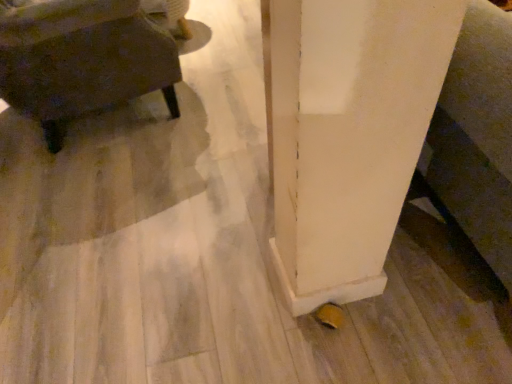
The height and width of the screenshot is (384, 512). Describe the element at coordinates (82, 59) in the screenshot. I see `matte dark brown coffee table at left` at that location.

This screenshot has height=384, width=512. In order to click on matte dark brown coffee table at left in this screenshot , I will do `click(82, 59)`.

The height and width of the screenshot is (384, 512). In order to click on white matte pillar at lower right in this screenshot , I will do `click(348, 134)`.

Consider the image. In order to face white matte pillar at lower right, should I rotate leftwards or rightwards?

Turn right approximately 34.573 degrees to face it.

Measure the distance between point (445, 61) and camera.

Point (445, 61) and camera are 26.65 inches apart.

What is the approximate height of white matte pillar at lower right?

31.15 inches.

This screenshot has width=512, height=384. What do you see at coordinates (348, 134) in the screenshot? I see `white matte pillar at lower right` at bounding box center [348, 134].

In order to click on matte dark brown coffee table at left in this screenshot , I will do `click(82, 59)`.

Considering the positions of objects white matte pillar at lower right and matte dark brown coffee table at left in the image provided, who is more to the right, white matte pillar at lower right or matte dark brown coffee table at left?

From the viewer's perspective, white matte pillar at lower right appears more on the right side.

In the image, is white matte pillar at lower right positioned in front of or behind matte dark brown coffee table at left?

In the image, white matte pillar at lower right appears in front of matte dark brown coffee table at left.

Considering the points (348, 206) and (142, 76), which point is in front, point (348, 206) or point (142, 76)?

The point (348, 206) is closer.

From the image's perspective, is white matte pillar at lower right beneath matte dark brown coffee table at left?

Indeed, from the image's perspective, white matte pillar at lower right is shown beneath matte dark brown coffee table at left.

From a real-world perspective, is white matte pillar at lower right under matte dark brown coffee table at left?

No, from a real-world perspective, white matte pillar at lower right is not below matte dark brown coffee table at left.

Is white matte pillar at lower right wider or thinner than matte dark brown coffee table at left?

Considering their sizes, white matte pillar at lower right looks broader than matte dark brown coffee table at left.

Does white matte pillar at lower right have a greater height compared to matte dark brown coffee table at left?

Yes.

Can you confirm if white matte pillar at lower right is bigger than matte dark brown coffee table at left?

Yes.

Do you think white matte pillar at lower right is within matte dark brown coffee table at left, or outside of it?

The correct answer is: outside.

Is white matte pillar at lower right far from matte dark brown coffee table at left?

Actually, white matte pillar at lower right and matte dark brown coffee table at left are a little close together.

Is white matte pillar at lower right facing away from matte dark brown coffee table at left?

No, white matte pillar at lower right is not facing away from matte dark brown coffee table at left.

How different are the orientations of white matte pillar at lower right and matte dark brown coffee table at left in degrees?

white matte pillar at lower right and matte dark brown coffee table at left are facing 72.2 degrees away from each other.

How distant is white matte pillar at lower right from matte dark brown coffee table at left?

white matte pillar at lower right is 36.01 inches from matte dark brown coffee table at left.

You are a GUI agent. You are given a task and a screenshot of the screen. Output one action in this format:
    pyautogui.click(x=<x>, y=<y>)
    Task: Click on the pillar in front of the matte dark brown coffee table at left
    Image resolution: width=512 pixels, height=384 pixels.
    Given the screenshot: What is the action you would take?
    pyautogui.click(x=348, y=134)

Which object is positioned more to the right, matte dark brown coffee table at left or white matte pillar at lower right?

white matte pillar at lower right.

Between matte dark brown coffee table at left and white matte pillar at lower right, which one is positioned behind?

matte dark brown coffee table at left is further away from the camera.

Between point (151, 68) and point (297, 308), which one is positioned in front?

Point (297, 308)

From the image's perspective, is matte dark brown coffee table at left located above or below white matte pillar at lower right?

From the image's perspective, matte dark brown coffee table at left appears above white matte pillar at lower right.

From a real-world perspective, is matte dark brown coffee table at left under white matte pillar at lower right?

Correct, in the physical world, matte dark brown coffee table at left is lower than white matte pillar at lower right.

Which object is wider, matte dark brown coffee table at left or white matte pillar at lower right?

Wider between the two is white matte pillar at lower right.

Is matte dark brown coffee table at left taller or shorter than white matte pillar at lower right?

Clearly, matte dark brown coffee table at left is shorter compared to white matte pillar at lower right.

Is matte dark brown coffee table at left bigger than white matte pillar at lower right?

No, matte dark brown coffee table at left is not bigger than white matte pillar at lower right.

Can white matte pillar at lower right be found inside matte dark brown coffee table at left?

Definitely not — white matte pillar at lower right is not inside matte dark brown coffee table at left.

Is there a large distance between matte dark brown coffee table at left and white matte pillar at lower right?

That's not correct — matte dark brown coffee table at left is a little close to white matte pillar at lower right.

From the picture: Is matte dark brown coffee table at left oriented towards white matte pillar at lower right?

No, matte dark brown coffee table at left is not aimed at white matte pillar at lower right.

Can you tell me how much matte dark brown coffee table at left and white matte pillar at lower right differ in facing direction?

matte dark brown coffee table at left and white matte pillar at lower right are facing 72.2 degrees away from each other.

How far apart are matte dark brown coffee table at left and white matte pillar at lower right?

A distance of 36.01 inches exists between matte dark brown coffee table at left and white matte pillar at lower right.

Locate an element on the screen. The image size is (512, 384). pillar to the right of matte dark brown coffee table at left is located at coordinates (348, 134).

Where is `furniture below the white matte pillar at lower right (from a real-world perspective)`? furniture below the white matte pillar at lower right (from a real-world perspective) is located at coordinates tap(82, 59).

The width and height of the screenshot is (512, 384). I want to click on furniture behind the white matte pillar at lower right, so click(x=82, y=59).